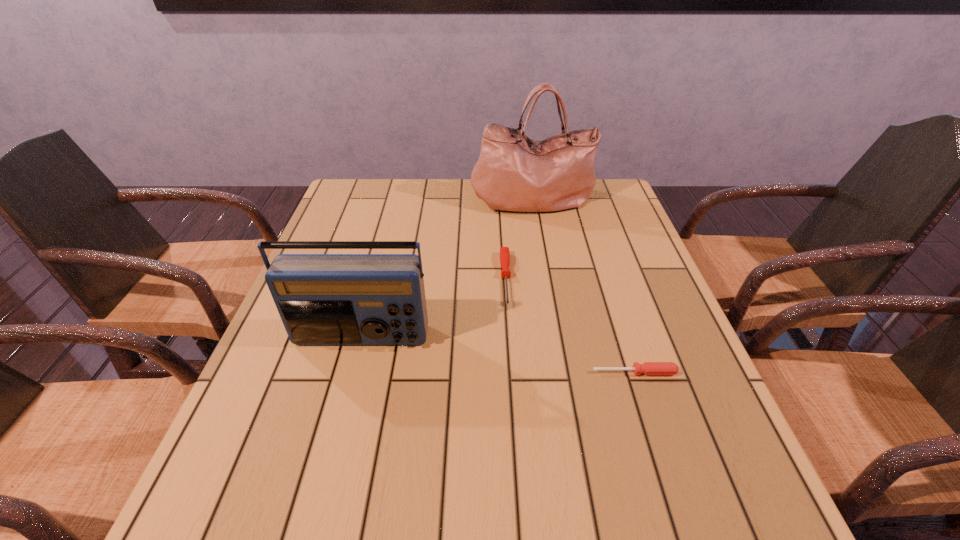
Identify the location of the farthest object. The image size is (960, 540). (514, 173).

Where is `the tallest object`? the tallest object is located at coordinates (514, 173).

This screenshot has height=540, width=960. What are the coordinates of `radio receiver` in the screenshot? It's located at (323, 299).

Find the location of a particular element. the leftmost object is located at coordinates (323, 299).

Where is `the farther screwdriver`? This screenshot has width=960, height=540. the farther screwdriver is located at coordinates (504, 251).

Identify the location of the second farthest object. (504, 251).

At what (x,y) coordinates should I click in order to perform the action: click on the right screwdriver. Please return your answer as a coordinate pair (x, y). This screenshot has width=960, height=540. Looking at the image, I should click on (648, 368).

Locate an element on the screen. The height and width of the screenshot is (540, 960). the nearer screwdriver is located at coordinates (648, 368).

The width and height of the screenshot is (960, 540). I want to click on vacant space located 0.140m at the front of the farthest object with handles, so click(540, 247).

I want to click on vacant space positioned 0.150m on the front panel of the radio receiver, so (x=341, y=414).